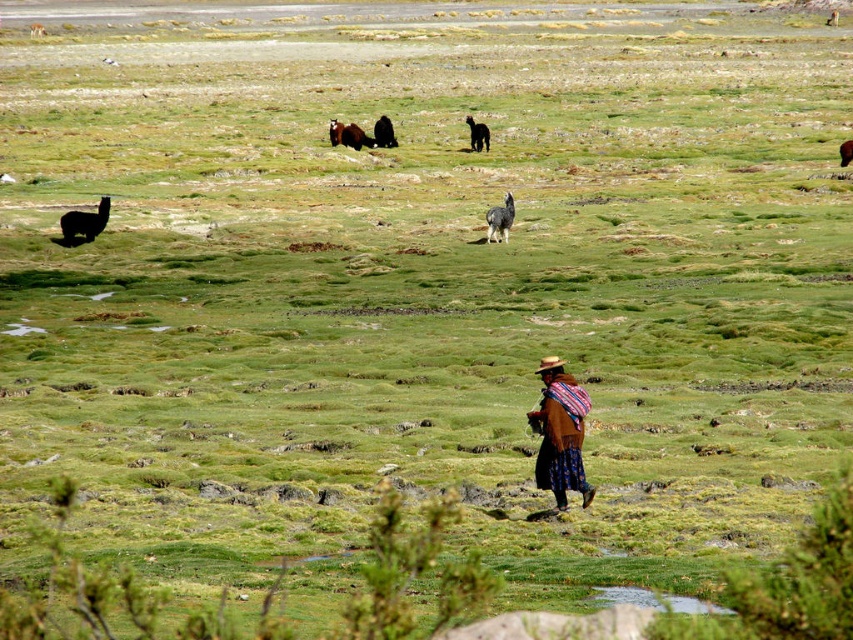
You are standing in the pastoral scene and want to place a small marker at the closer of the two points, point (x=514, y=204) and point (x=480, y=131). According to the image, which point should you choose?

Point (x=514, y=204) is closer to the viewer than point (x=480, y=131), so you should choose point (x=514, y=204) to place the small marker.